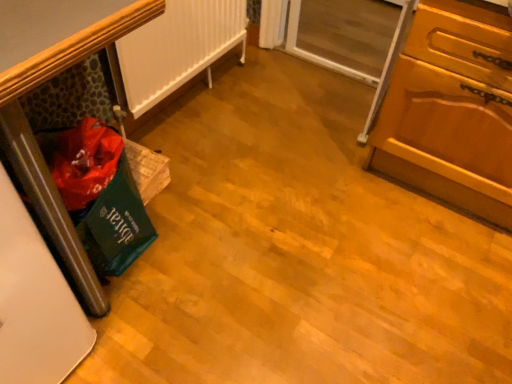
Question: From their relative heights in the image, would you say green fabric bag at left is taller or shorter than white matte radiator at left?

Choices:
 (A) short
 (B) tall

Answer: (A)

Question: Based on their positions, is green fabric bag at left located to the left or right of white matte radiator at left?

Choices:
 (A) right
 (B) left

Answer: (B)

Question: Which is nearer to the green fabric bag at left?

Choices:
 (A) white matte radiator at left
 (B) wooden cabinet at right
 (C) transparent glass screen door at upper right

Answer: (A)

Question: Which object is the farthest from the white matte radiator at left?

Choices:
 (A) green fabric bag at left
 (B) transparent glass screen door at upper right
 (C) wooden cabinet at right

Answer: (C)